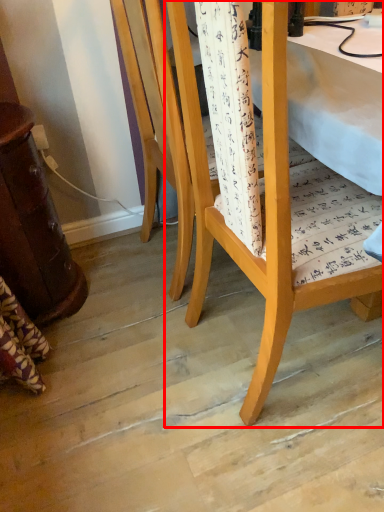
Question: From the image's perspective, what is the correct spatial relationship of chair (annotated by the red box) in relation to chair?

Choices:
 (A) below
 (B) above

Answer: (A)